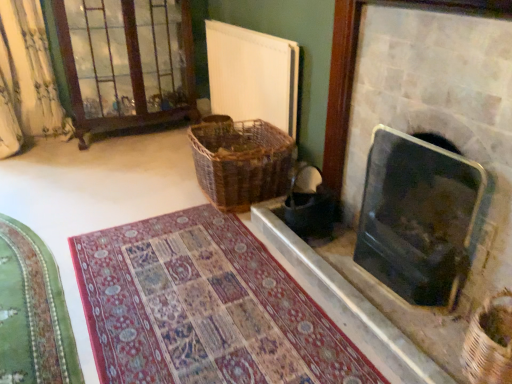
What are the coordinates of `brown wooden glass door at upper left` in the screenshot? It's located at (127, 60).

Measure the distance between brown wooden glass door at upper left and camera.

A distance of 2.69 meters exists between brown wooden glass door at upper left and camera.

Locate an element on the screen. The width and height of the screenshot is (512, 384). white matte radiator at upper center is located at coordinates (252, 75).

The width and height of the screenshot is (512, 384). Describe the element at coordinates (417, 218) in the screenshot. I see `black glass fireplace at right, marked as the second fireplace in a top-to-bottom arrangement` at that location.

Measure the distance between point (x=293, y=219) and camera.

A distance of 2.01 meters exists between point (x=293, y=219) and camera.

Describe the element at coordinates (241, 162) in the screenshot. I see `woven brown basket at center, which is the 2th basket in front-to-back order` at that location.

Where is `patterned carpet at center, acting as the 2th mat starting from the left`? This screenshot has width=512, height=384. patterned carpet at center, acting as the 2th mat starting from the left is located at coordinates (204, 308).

I want to click on brown wooden glass door at upper left, so click(x=127, y=60).

Locate an element on the screen. The width and height of the screenshot is (512, 384). fireplace in front of the patterned carpet at center, acting as the 2th mat starting from the left is located at coordinates (385, 163).

Does patterned carpet at center, acting as the 2th mat starting from the left, have a lesser height compared to black glass fireplace at right, the 1th fireplace when ordered from top to bottom?

Yes.

Is patterned carpet at center, the first mat positioned from the right, far from black glass fireplace at right, the 1th fireplace when ordered from top to bottom?

patterned carpet at center, the first mat positioned from the right, is near black glass fireplace at right, the 1th fireplace when ordered from top to bottom, not far away.

Is black glass fireplace at right, which is the first fireplace from bottom to top, at the right side of green velvet mat at lower left, the 2th mat when ordered from right to left?

Yes.

Considering the sizes of objects black glass fireplace at right, which is the first fireplace from bottom to top, and green velvet mat at lower left, the 2th mat when ordered from right to left, in the image provided, who is smaller, black glass fireplace at right, which is the first fireplace from bottom to top, or green velvet mat at lower left, the 2th mat when ordered from right to left,?

green velvet mat at lower left, the 2th mat when ordered from right to left, is smaller.

Does point (441, 242) come closer to viewer compared to point (18, 228)?

Yes, it is in front of point (18, 228).

How far apart are black glass fireplace at right, which is the first fireplace from bottom to top, and green velvet mat at lower left, positioned as the first mat in left-to-right order?

black glass fireplace at right, which is the first fireplace from bottom to top, is 1.30 meters from green velvet mat at lower left, positioned as the first mat in left-to-right order.

What are the coordinates of `the 1st mat behind the black glass fireplace at right, marked as the 2th fireplace in a bottom-to-top arrangement, starting your count from the anchor` in the screenshot? It's located at (204, 308).

From a real-world perspective, which object stands above the other?

In real-world perspective, black glass fireplace at right, marked as the 2th fireplace in a bottom-to-top arrangement, is above.

Can we say black glass fireplace at right, marked as the 2th fireplace in a bottom-to-top arrangement, lies outside patterned carpet at center, the first mat positioned from the right?

Indeed, black glass fireplace at right, marked as the 2th fireplace in a bottom-to-top arrangement, is completely outside patterned carpet at center, the first mat positioned from the right.

Is there a large distance between dark brown woven laundry basket at center and brown wooden glass door at upper left?

Yes.

Considering the sizes of objects dark brown woven laundry basket at center and brown wooden glass door at upper left in the image provided, who is smaller, dark brown woven laundry basket at center or brown wooden glass door at upper left?

With smaller size is dark brown woven laundry basket at center.

Considering the relative positions of dark brown woven laundry basket at center and brown wooden glass door at upper left in the image provided, is dark brown woven laundry basket at center to the right of brown wooden glass door at upper left from the viewer's perspective?

Indeed, dark brown woven laundry basket at center is positioned on the right side of brown wooden glass door at upper left.

Is dark brown woven laundry basket at center facing away from brown wooden glass door at upper left?

No, brown wooden glass door at upper left is not at the back of dark brown woven laundry basket at center.

Considering the relative sizes of brown wooden glass door at upper left and green velvet mat at lower left, positioned as the first mat in left-to-right order, in the image provided, is brown wooden glass door at upper left thinner than green velvet mat at lower left, positioned as the first mat in left-to-right order,?

Incorrect, the width of brown wooden glass door at upper left is not less than that of green velvet mat at lower left, positioned as the first mat in left-to-right order.

Between brown wooden glass door at upper left and green velvet mat at lower left, positioned as the first mat in left-to-right order, which one has less height?

Standing shorter between the two is green velvet mat at lower left, positioned as the first mat in left-to-right order.

Is point (108, 3) closer to camera compared to point (22, 270)?

That is False.

Is brown wooden glass door at upper left in contact with green velvet mat at lower left, positioned as the first mat in left-to-right order?

No, brown wooden glass door at upper left is not next to green velvet mat at lower left, positioned as the first mat in left-to-right order.

I want to click on glass door behind the woven brown basket at lower right, placed as the second basket when sorted from top to bottom, so click(x=127, y=60).

Is brown wooden glass door at upper left far away from woven brown basket at lower right, positioned as the first basket in bottom-to-top order?

Yes, brown wooden glass door at upper left and woven brown basket at lower right, positioned as the first basket in bottom-to-top order, are located far from each other.

Is brown wooden glass door at upper left wider or thinner than woven brown basket at lower right, placed as the second basket when sorted from top to bottom?

Clearly, brown wooden glass door at upper left has more width compared to woven brown basket at lower right, placed as the second basket when sorted from top to bottom.

From a real-world perspective, does brown wooden glass door at upper left sit lower than woven brown basket at lower right, the 1th basket viewed from the front?

No, from a real-world perspective, brown wooden glass door at upper left is not beneath woven brown basket at lower right, the 1th basket viewed from the front.

Is woven brown basket at center, arranged as the first basket when viewed from the top, far from green velvet mat at lower left, positioned as the first mat in left-to-right order?

woven brown basket at center, arranged as the first basket when viewed from the top, is positioned a significant distance from green velvet mat at lower left, positioned as the first mat in left-to-right order.

Between woven brown basket at center, which is counted as the second basket, starting from the bottom, and green velvet mat at lower left, the 2th mat when ordered from right to left, which one has smaller size?

Smaller between the two is green velvet mat at lower left, the 2th mat when ordered from right to left.

Is woven brown basket at center, arranged as the first basket when viewed from the top, wider than green velvet mat at lower left, positioned as the first mat in left-to-right order?

Indeed, woven brown basket at center, arranged as the first basket when viewed from the top, has a greater width compared to green velvet mat at lower left, positioned as the first mat in left-to-right order.

Which object is closer to the camera taking this photo, woven brown basket at center, which is the 2th basket in front-to-back order, or green velvet mat at lower left, positioned as the first mat in left-to-right order?

Positioned in front is green velvet mat at lower left, positioned as the first mat in left-to-right order.

The image size is (512, 384). I want to click on mat that is the 2nd one below the black glass fireplace at right, the 1th fireplace when ordered from top to bottom (from a real-world perspective), so click(204, 308).

Find the location of a particular element. The height and width of the screenshot is (384, 512). fireplace behind the green velvet mat at lower left, positioned as the first mat in left-to-right order is located at coordinates (417, 218).

Consider the image. When comparing their distances from patterned carpet at center, the first mat positioned from the right, does dark brown woven laundry basket at center or woven brown basket at lower right, placed as the second basket when sorted from top to bottom, seem further?

Based on the image, woven brown basket at lower right, placed as the second basket when sorted from top to bottom, appears to be further to patterned carpet at center, the first mat positioned from the right.

Estimate the real-world distances between objects in this image. Which object is closer to woven brown basket at lower right, which is the 1th basket from right to left, brown wooden glass door at upper left or patterned carpet at center, acting as the 2th mat starting from the left?

patterned carpet at center, acting as the 2th mat starting from the left, is closer to woven brown basket at lower right, which is the 1th basket from right to left.

When comparing their distances from white matte radiator at upper center, does brown wooden glass door at upper left or woven brown basket at center, which is counted as the second basket, starting from the bottom, seem further?

Among the two, brown wooden glass door at upper left is located further to white matte radiator at upper center.

Looking at the image, which one is located further to black glass fireplace at right, the 1th fireplace when ordered from top to bottom, brown wooden glass door at upper left or woven brown basket at center, arranged as the first basket when viewed from the top?

Based on the image, brown wooden glass door at upper left appears to be further to black glass fireplace at right, the 1th fireplace when ordered from top to bottom.

Which object lies nearer to the anchor point dark brown woven laundry basket at center, black glass fireplace at right, marked as the second fireplace in a top-to-bottom arrangement, or brown wooden glass door at upper left?

Based on the image, black glass fireplace at right, marked as the second fireplace in a top-to-bottom arrangement, appears to be nearer to dark brown woven laundry basket at center.

Which object lies nearer to the anchor point black glass fireplace at right, the 1th fireplace when ordered from top to bottom, white matte radiator at upper center or brown wooden glass door at upper left?

Among the two, white matte radiator at upper center is located nearer to black glass fireplace at right, the 1th fireplace when ordered from top to bottom.

From the picture: Estimate the real-world distances between objects in this image. Which object is further from woven brown basket at lower right, positioned as the first basket in bottom-to-top order, white matte radiator at upper center or patterned carpet at center, acting as the 2th mat starting from the left?

Based on the image, white matte radiator at upper center appears to be further to woven brown basket at lower right, positioned as the first basket in bottom-to-top order.

Based on their spatial positions, is black glass fireplace at right, the 1th fireplace when ordered from top to bottom, or brown wooden glass door at upper left further from black glass fireplace at right, which is the first fireplace from bottom to top?

brown wooden glass door at upper left is positioned further to the anchor black glass fireplace at right, which is the first fireplace from bottom to top.

The width and height of the screenshot is (512, 384). What are the coordinates of `laundry basket between woven brown basket at lower right, the 1th basket viewed from the front, and woven brown basket at center, the 2th basket from the right, along the z-axis` in the screenshot? It's located at (309, 208).

Where is `laundry basket between green velvet mat at lower left, positioned as the first mat in left-to-right order, and woven brown basket at lower right, the 1th basket viewed from the front, from left to right`? The image size is (512, 384). laundry basket between green velvet mat at lower left, positioned as the first mat in left-to-right order, and woven brown basket at lower right, the 1th basket viewed from the front, from left to right is located at coordinates (309, 208).

Locate an element on the screen. Image resolution: width=512 pixels, height=384 pixels. radiator between black glass fireplace at right, marked as the 2th fireplace in a bottom-to-top arrangement, and brown wooden glass door at upper left from front to back is located at coordinates (x=252, y=75).

Locate an element on the screen. fireplace positioned between patterned carpet at center, acting as the 2th mat starting from the left, and white matte radiator at upper center from near to far is located at coordinates (417, 218).